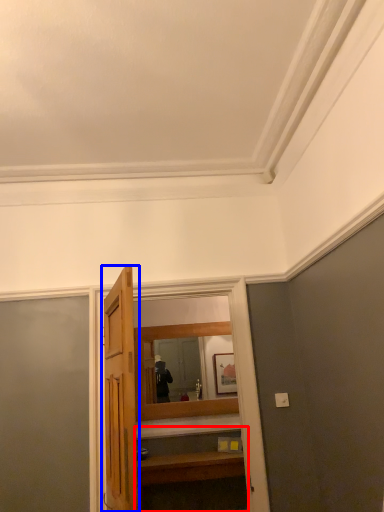
Question: Which point is closer to the camera, vanity (highlighted by a red box) or door (highlighted by a blue box)?

Choices:
 (A) vanity
 (B) door

Answer: (B)